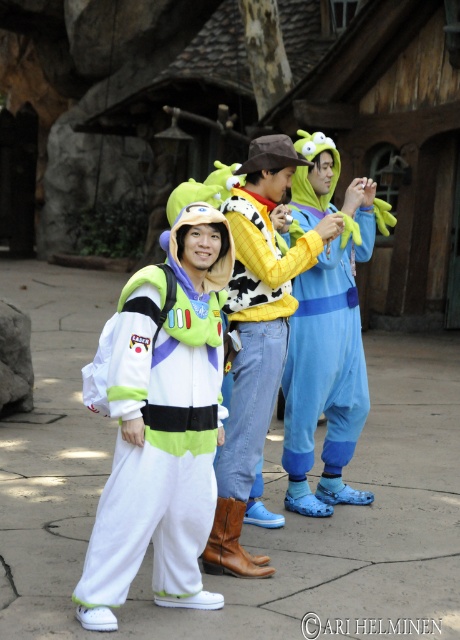
Who is more forward, (288, 371) or (304, 257)?

Point (304, 257)

Between point (302, 330) and point (253, 435), which one is positioned in front?

Point (253, 435)

This screenshot has width=460, height=640. What are the coordinates of `blue plush onesie at center` in the screenshot? It's located at (327, 368).

Between point (165, 243) and point (258, 412), which one is positioned in front?

Point (165, 243) is in front.

What do you see at coordinates (162, 426) in the screenshot?
I see `white fleece jacket at center` at bounding box center [162, 426].

I want to click on white fleece jacket at center, so tap(162, 426).

Does white fleece jacket at center have a smaller size compared to blue plush onesie at center?

Yes, white fleece jacket at center is smaller than blue plush onesie at center.

Who is positioned more to the left, white fleece jacket at center or blue plush onesie at center?

white fleece jacket at center is more to the left.

What do you see at coordinates (162, 426) in the screenshot?
I see `white fleece jacket at center` at bounding box center [162, 426].

Identify the location of white fleece jacket at center. The height and width of the screenshot is (640, 460). (162, 426).